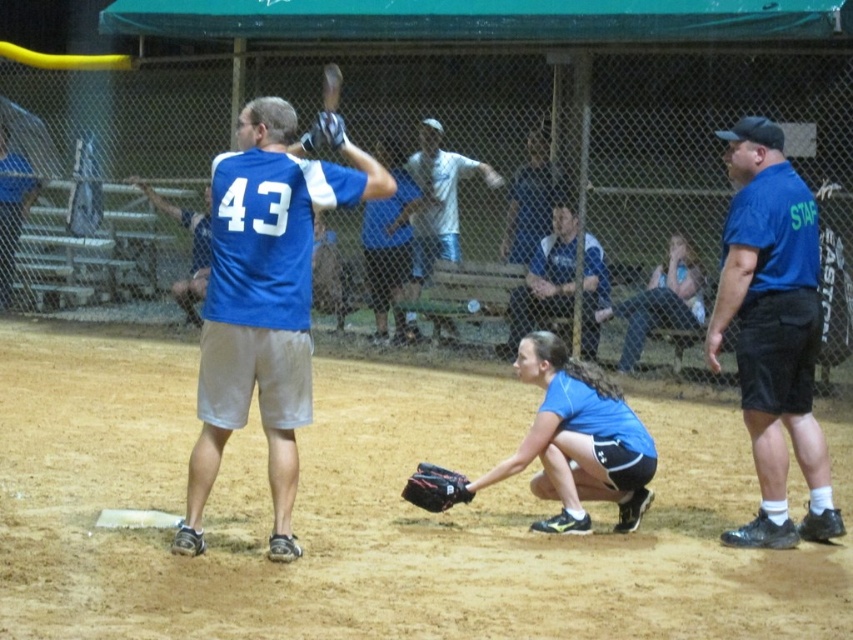
You are a spectator at the softball game and want to know which object is wider between the blue fabric shirt at right and the blue matte baseball glove at center. Can you tell me?

The blue fabric shirt at right is less wide than the blue matte baseball glove at center.

You are a coach observing the softball game. You notice two gloves on the field. Which glove is bigger? The blue matte baseball glove at center or the dark brown leather glove at lower center?

The blue matte baseball glove at center has a larger size compared to the dark brown leather glove at lower center.